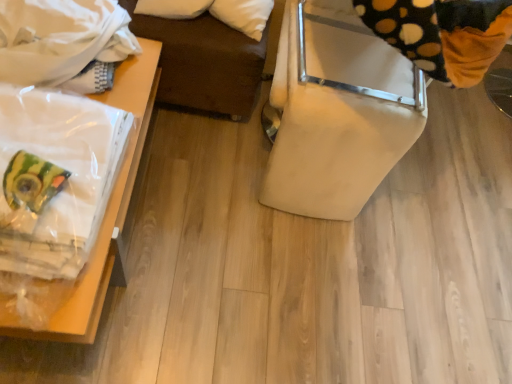
Question: Does white cotton blanket at upper left come behind clear plastic bag at left, placed as the 2th furniture when sorted from right to left?

Choices:
 (A) yes
 (B) no

Answer: (A)

Question: Is the position of white cotton blanket at upper left less distant than that of clear plastic bag at left, arranged as the first furniture when viewed from the left?

Choices:
 (A) no
 (B) yes

Answer: (A)

Question: From the image's perspective, is white cotton blanket at upper left on top of clear plastic bag at left, placed as the 2th furniture when sorted from right to left?

Choices:
 (A) no
 (B) yes

Answer: (B)

Question: Considering the relative sizes of white cotton blanket at upper left and clear plastic bag at left, arranged as the first furniture when viewed from the left, in the image provided, is white cotton blanket at upper left shorter than clear plastic bag at left, arranged as the first furniture when viewed from the left,?

Choices:
 (A) yes
 (B) no

Answer: (A)

Question: Is white cotton blanket at upper left to the right of clear plastic bag at left, arranged as the first furniture when viewed from the left, from the viewer's perspective?

Choices:
 (A) yes
 (B) no

Answer: (B)

Question: Is point (68, 76) positioned closer to the camera than point (138, 110)?

Choices:
 (A) farther
 (B) closer

Answer: (B)

Question: Based on their sizes in the image, would you say white cotton blanket at upper left is bigger or smaller than clear plastic bag at left, placed as the 2th furniture when sorted from right to left?

Choices:
 (A) big
 (B) small

Answer: (B)

Question: Relative to clear plastic bag at left, placed as the 2th furniture when sorted from right to left, is white cotton blanket at upper left in front or behind?

Choices:
 (A) behind
 (B) front

Answer: (A)

Question: Is white cotton blanket at upper left inside or outside of clear plastic bag at left, arranged as the first furniture when viewed from the left?

Choices:
 (A) inside
 (B) outside

Answer: (B)

Question: In the image, is black dotted fabric at upper right positioned in front of or behind white cotton blanket at upper left?

Choices:
 (A) behind
 (B) front

Answer: (B)

Question: In terms of size, does black dotted fabric at upper right appear bigger or smaller than white cotton blanket at upper left?

Choices:
 (A) small
 (B) big

Answer: (B)

Question: In terms of width, does black dotted fabric at upper right look wider or thinner when compared to white cotton blanket at upper left?

Choices:
 (A) wide
 (B) thin

Answer: (A)

Question: From a real-world perspective, relative to white cotton blanket at upper left, is black dotted fabric at upper right vertically above or below?

Choices:
 (A) above
 (B) below

Answer: (A)

Question: Considering the positions of clear plastic bag at left, arranged as the first furniture when viewed from the left, and white cotton blanket at upper left in the image, is clear plastic bag at left, arranged as the first furniture when viewed from the left, taller or shorter than white cotton blanket at upper left?

Choices:
 (A) tall
 (B) short

Answer: (A)

Question: From the image's perspective, relative to white cotton blanket at upper left, is clear plastic bag at left, arranged as the first furniture when viewed from the left, above or below?

Choices:
 (A) below
 (B) above

Answer: (A)